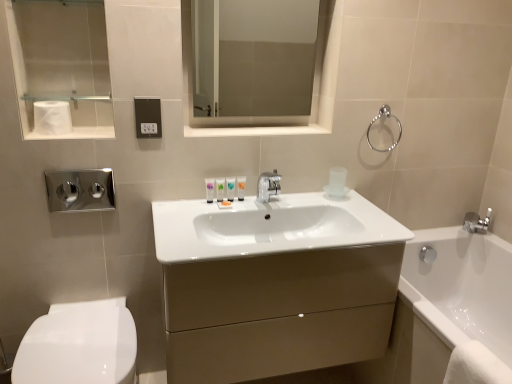
Question: Which direction should I rotate to look at translucent plastic tube at center, the third toiletry in the left-to-right sequence?

Choices:
 (A) right
 (B) left

Answer: (B)

Question: Is white glossy tube at center, which is the 1th toiletry from right to left, surrounded by transparent glass medicine cabinet at upper center?

Choices:
 (A) no
 (B) yes

Answer: (A)

Question: Are transparent glass medicine cabinet at upper center and white glossy tube at center, which is the 1th toiletry from right to left, beside each other?

Choices:
 (A) no
 (B) yes

Answer: (A)

Question: Is transparent glass medicine cabinet at upper center not within white glossy tube at center, which is the 4th toiletry in left-to-right order?

Choices:
 (A) yes
 (B) no

Answer: (A)

Question: Is transparent glass medicine cabinet at upper center facing towards white glossy tube at center, which is the 1th toiletry from right to left?

Choices:
 (A) yes
 (B) no

Answer: (B)

Question: From a real-world perspective, is transparent glass medicine cabinet at upper center positioned under white glossy tube at center, which is the 1th toiletry from right to left, based on gravity?

Choices:
 (A) yes
 (B) no

Answer: (B)

Question: Can you confirm if transparent glass medicine cabinet at upper center is thinner than white glossy tube at center, which is the 4th toiletry in left-to-right order?

Choices:
 (A) yes
 (B) no

Answer: (A)

Question: Considering the relative sizes of white matte toilet paper at upper left and polished chrome faucet at lower right in the image provided, is white matte toilet paper at upper left taller than polished chrome faucet at lower right?

Choices:
 (A) no
 (B) yes

Answer: (B)

Question: Is white matte toilet paper at upper left facing towards polished chrome faucet at lower right?

Choices:
 (A) no
 (B) yes

Answer: (A)

Question: Does white matte toilet paper at upper left appear on the left side of polished chrome faucet at lower right?

Choices:
 (A) no
 (B) yes

Answer: (B)

Question: Is white matte toilet paper at upper left positioned behind polished chrome faucet at lower right?

Choices:
 (A) no
 (B) yes

Answer: (A)

Question: Can you confirm if white matte toilet paper at upper left is bigger than polished chrome faucet at lower right?

Choices:
 (A) no
 (B) yes

Answer: (B)

Question: From the image's perspective, is white matte toilet paper at upper left located above polished chrome faucet at lower right?

Choices:
 (A) no
 (B) yes

Answer: (B)

Question: Is brushed metal towel bar at upper left smaller than translucent plastic tube at center, which is counted as the second toiletry, starting from the right?

Choices:
 (A) yes
 (B) no

Answer: (B)